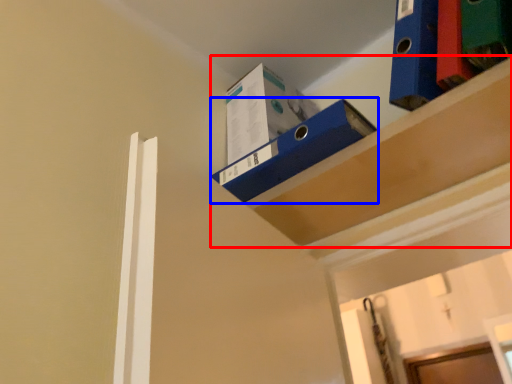
Question: Which object appears closest to the camera in this image, shelf (highlighted by a red box) or shelf (highlighted by a blue box)?

Choices:
 (A) shelf
 (B) shelf

Answer: (A)